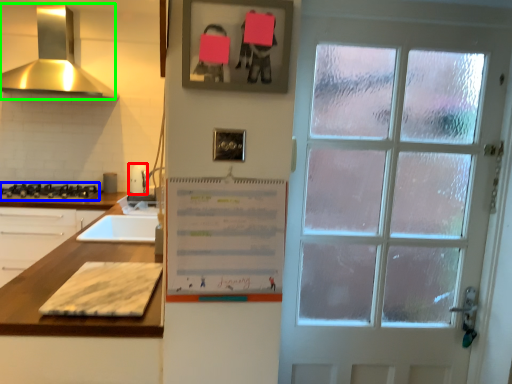
Question: Which object is the closest to the appliance (highlighted by a red box)? Choose among these: gas stove (highlighted by a blue box) or exhaust hood (highlighted by a green box).

Choices:
 (A) gas stove
 (B) exhaust hood

Answer: (A)